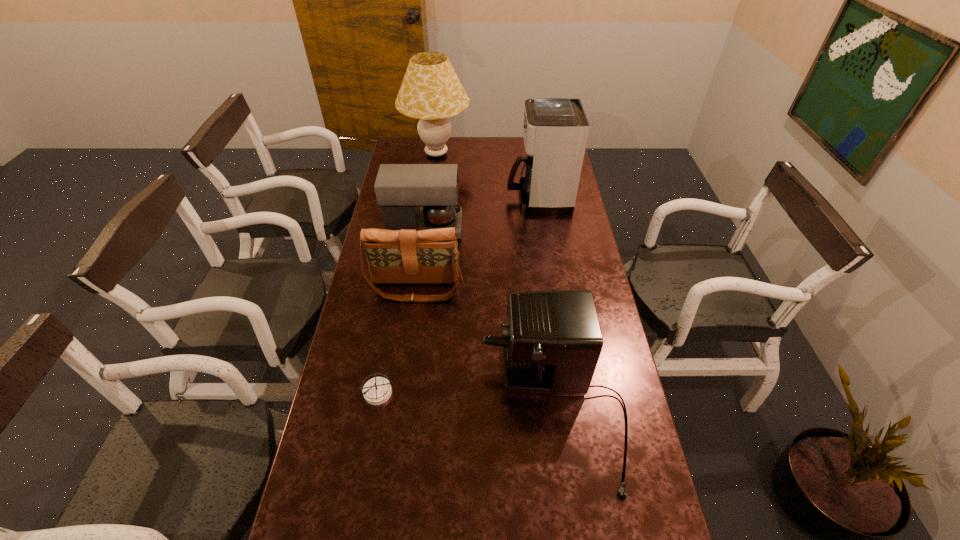
Locate an element on the screen. This screenshot has height=540, width=960. coffee maker that is at the left edge is located at coordinates (400, 189).

The image size is (960, 540). Find the location of `shoulder bag positioned at the left edge`. shoulder bag positioned at the left edge is located at coordinates (394, 256).

Where is `compass positioned at the left edge`? This screenshot has height=540, width=960. compass positioned at the left edge is located at coordinates (376, 391).

Image resolution: width=960 pixels, height=540 pixels. In order to click on object situated at the far left corner in this screenshot , I will do `click(431, 91)`.

The image size is (960, 540). Find the location of `free space at the far edge`. free space at the far edge is located at coordinates (511, 162).

The image size is (960, 540). In the image, there is a desktop. Find the location of `vacant space at the left edge`. vacant space at the left edge is located at coordinates (348, 418).

In the image, there is a desktop. Identify the location of vacant space at the right edge. (574, 261).

Identify the location of vacant space that is in between the farthest object and the tallest coffee maker. (488, 176).

Find the location of a particular element. vacant space that's between the fifth nearest object and the shortest object is located at coordinates (458, 295).

You are a GUI agent. You are given a task and a screenshot of the screen. Output one action in this format:
    pyautogui.click(x=<x>, y=<y>)
    Task: Click on the vacant region between the second farthest object and the leftmost coffee maker
    
    Given the screenshot: What is the action you would take?
    pyautogui.click(x=481, y=213)